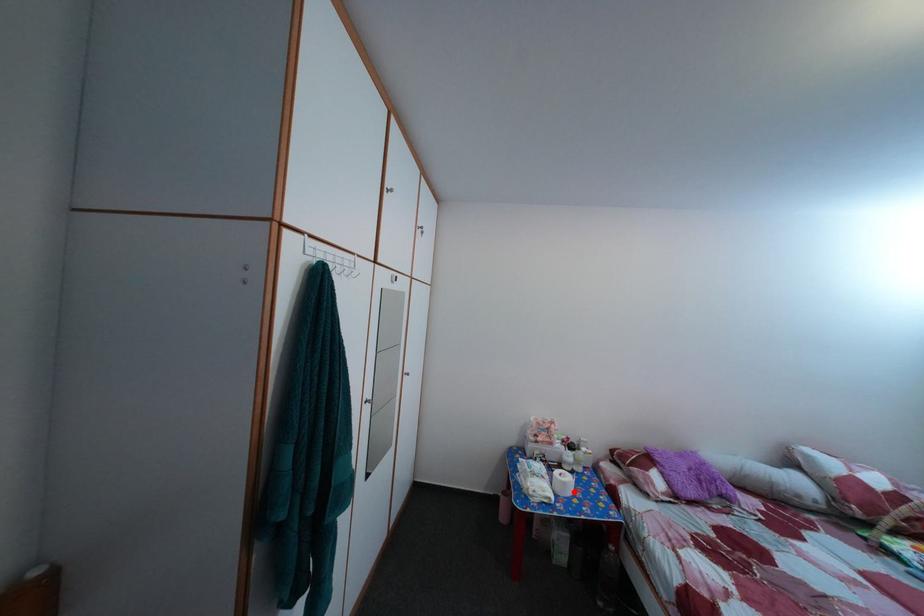
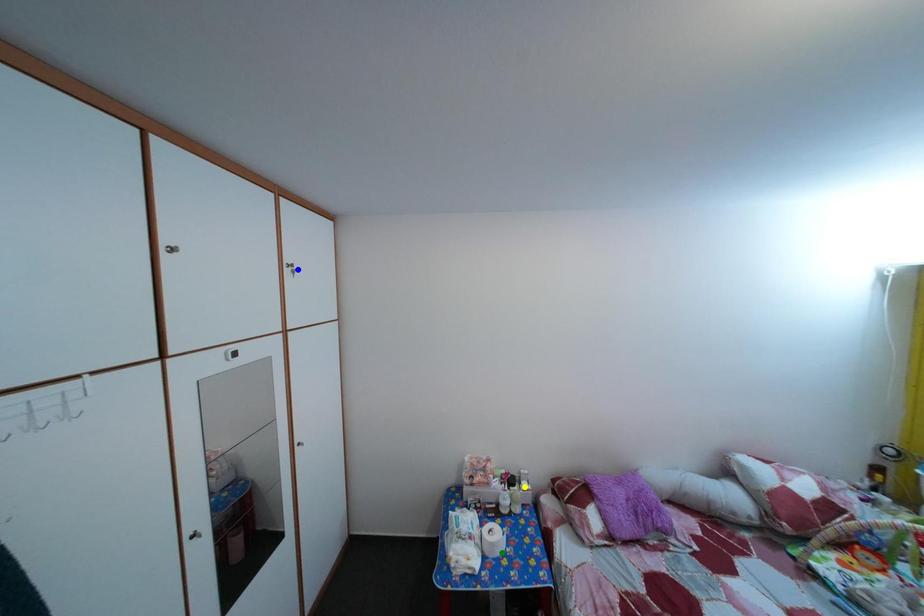
Question: I am providing you with two images of the same scene from different viewpoints. A red point is marked on the first image. You are given multiple points on the second image. Can you choose the point in image 2 that corresponds to the point in image 1?

Choices:
 (A) blue point
 (B) green point
 (C) yellow point

Answer: (B)